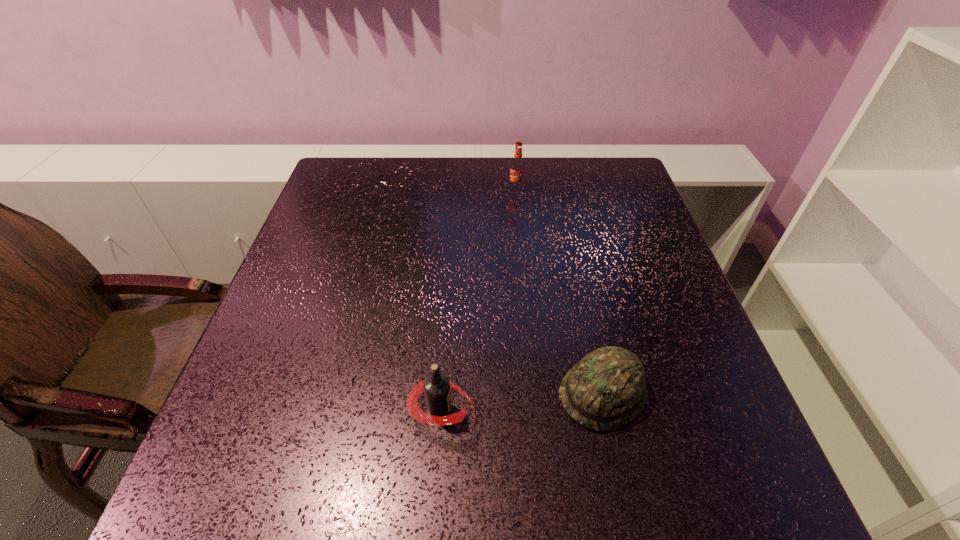
Find the location of `object present at the right edge`. object present at the right edge is located at coordinates [605, 390].

In the image, there is a desktop. Where is `free space at the far edge`? The image size is (960, 540). free space at the far edge is located at coordinates (573, 197).

Find the location of `free space at the near edge of the desktop`. free space at the near edge of the desktop is located at coordinates (438, 484).

Where is `vacant space at the left edge of the desktop`? Image resolution: width=960 pixels, height=540 pixels. vacant space at the left edge of the desktop is located at coordinates (255, 429).

This screenshot has height=540, width=960. In order to click on free space at the right edge of the desktop in this screenshot , I will do `click(627, 334)`.

I want to click on vacant region at the far left corner of the desktop, so click(x=387, y=160).

The image size is (960, 540). Identify the location of free space at the near left corner. (217, 474).

What are the coordinates of `free space at the far right corner of the desktop` in the screenshot? It's located at (601, 165).

The width and height of the screenshot is (960, 540). I want to click on vacant region between the farthest object and the leftmost object, so click(478, 299).

The height and width of the screenshot is (540, 960). In order to click on vacant region between the rightmost object and the nearer root beer in this screenshot , I will do `click(522, 401)`.